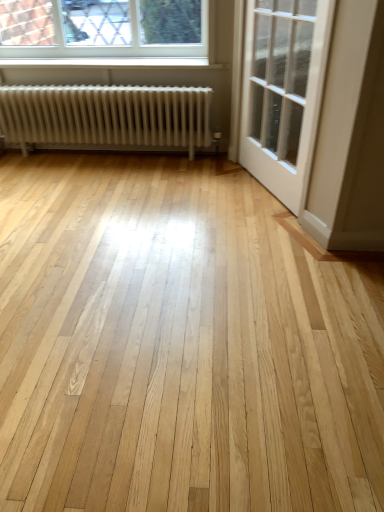
The image size is (384, 512). Identify the location of white matte radiator at left. (107, 117).

The width and height of the screenshot is (384, 512). In order to click on white matte radiator at left in this screenshot , I will do `click(107, 117)`.

Would you say white matte radiator at left is outside clear glass window at upper left?

Yes, white matte radiator at left is not within clear glass window at upper left.

Between white matte radiator at left and clear glass window at upper left, which one has less height?

Standing shorter between the two is clear glass window at upper left.

In the scene shown: From a real-world perspective, does white matte radiator at left stand above clear glass window at upper left?

Actually, white matte radiator at left is physically below clear glass window at upper left in the real world.

Looking at their sizes, would you say white glossy door at upper right is wider or thinner than white matte radiator at left?

white glossy door at upper right is thinner than white matte radiator at left.

Is the surface of white glossy door at upper right in direct contact with white matte radiator at left?

No, white glossy door at upper right is not next to white matte radiator at left.

Can you confirm if white glossy door at upper right is smaller than white matte radiator at left?

Yes, white glossy door at upper right is smaller than white matte radiator at left.

Consider the image. Considering the sizes of white glossy door at upper right and white matte radiator at left in the image, is white glossy door at upper right taller or shorter than white matte radiator at left?

Clearly, white glossy door at upper right is taller compared to white matte radiator at left.

From the image's perspective, is clear glass window at upper left positioned above or below white matte radiator at left?

From the image's perspective, clear glass window at upper left appears above white matte radiator at left.

Is clear glass window at upper left wider than white matte radiator at left?

No.

Is there a large distance between clear glass window at upper left and white matte radiator at left?

Actually, clear glass window at upper left and white matte radiator at left are a little close together.

Which is behind, clear glass window at upper left or white matte radiator at left?

clear glass window at upper left is further from the camera.

Can you see clear glass window at upper left touching white glossy door at upper right?

clear glass window at upper left and white glossy door at upper right are not in contact.

From the image's perspective, is clear glass window at upper left located above white glossy door at upper right?

Yes, from the image's perspective, clear glass window at upper left is above white glossy door at upper right.

Is clear glass window at upper left not inside white glossy door at upper right?

Yes, clear glass window at upper left is not within white glossy door at upper right.

In the scene shown: Is white glossy door at upper right positioned behind clear glass window at upper left?

No, the depth of white glossy door at upper right is less than that of clear glass window at upper left.

Considering the sizes of objects white glossy door at upper right and clear glass window at upper left in the image provided, who is wider, white glossy door at upper right or clear glass window at upper left?

white glossy door at upper right is wider.

Can we say white glossy door at upper right lies outside clear glass window at upper left?

Yes, white glossy door at upper right is not within clear glass window at upper left.

Is white glossy door at upper right aimed at clear glass window at upper left?

No.

Identify the location of radiator above the white glossy door at upper right (from the image's perspective). (107, 117).

Is white matte radiator at left inside the boundaries of white glossy door at upper right, or outside?

white matte radiator at left exists outside the volume of white glossy door at upper right.

Considering the positions of objects white matte radiator at left and white glossy door at upper right in the image provided, who is behind, white matte radiator at left or white glossy door at upper right?

Positioned behind is white matte radiator at left.

What's the angular difference between white matte radiator at left and white glossy door at upper right's facing directions?

There is a 68.2-degree angle between the facing directions of white matte radiator at left and white glossy door at upper right.

Locate an element on the screen. The height and width of the screenshot is (512, 384). window above the white matte radiator at left (from a real-world perspective) is located at coordinates click(103, 28).

Where is `door lying in front of the white matte radiator at left`? This screenshot has height=512, width=384. door lying in front of the white matte radiator at left is located at coordinates (282, 90).

When comparing their distances from clear glass window at upper left, does white glossy door at upper right or white matte radiator at left seem further?

white glossy door at upper right.

When comparing their distances from white glossy door at upper right, does clear glass window at upper left or white matte radiator at left seem further?

The object further to white glossy door at upper right is clear glass window at upper left.

From the image, which object appears to be farther from white matte radiator at left, white glossy door at upper right or clear glass window at upper left?

Among the two, white glossy door at upper right is located further to white matte radiator at left.

Which object lies further to the anchor point white glossy door at upper right, white matte radiator at left or clear glass window at upper left?

Based on the image, clear glass window at upper left appears to be further to white glossy door at upper right.

Looking at the image, which one is located further to white matte radiator at left, clear glass window at upper left or white glossy door at upper right?

Based on the image, white glossy door at upper right appears to be further to white matte radiator at left.

When comparing their distances from clear glass window at upper left, does white matte radiator at left or white glossy door at upper right seem further?

white glossy door at upper right is positioned further to the anchor clear glass window at upper left.

Locate an element on the screen. radiator between clear glass window at upper left and white glossy door at upper right in the horizontal direction is located at coordinates (107, 117).